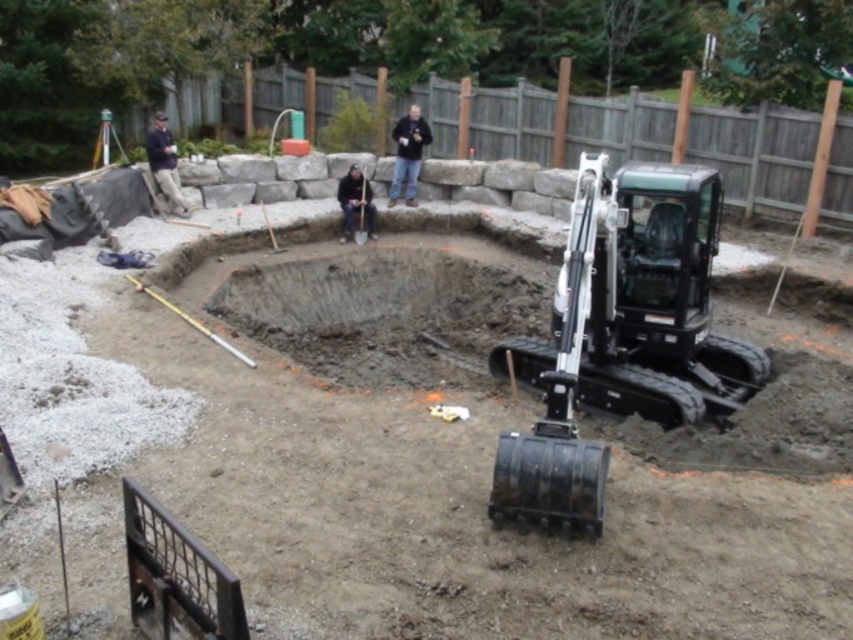
Question: Can you confirm if black rubber excavator at lower right is positioned below black matte jacket at center?

Choices:
 (A) yes
 (B) no

Answer: (A)

Question: Is black matte jacket at center positioned at the back of black fabric at center?

Choices:
 (A) yes
 (B) no

Answer: (A)

Question: Which point is closer to the camera?

Choices:
 (A) (409, 141)
 (B) (361, 225)
 (C) (352, 195)
 (D) (645, 172)

Answer: (D)

Question: Which point is farther to the camera?

Choices:
 (A) black fabric at center
 (B) black plastic shovel at center
 (C) dark blue shirt at upper left
 (D) black matte jacket at center

Answer: (D)

Question: Observing the image, what is the correct spatial positioning of black matte jacket at center in reference to black fabric at center?

Choices:
 (A) right
 (B) left

Answer: (A)

Question: Which object is closer to the camera taking this photo?

Choices:
 (A) black plastic shovel at center
 (B) black fabric at center

Answer: (B)